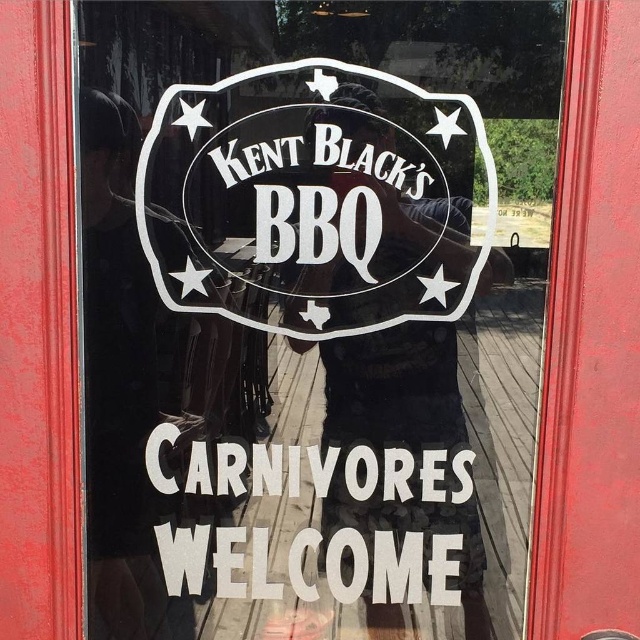
What do you see at coordinates (257, 468) in the screenshot?
I see `white matte sign at center` at bounding box center [257, 468].

Which of these two, white matte sign at center or white vinyl sign at center, stands shorter?

With less height is white matte sign at center.

Does point (458, 493) lie in front of point (262, 67)?

No.

At what (x,y) coordinates should I click in order to perform the action: click on white matte sign at center. Please return your answer as a coordinate pair (x, y). This screenshot has width=640, height=640. Looking at the image, I should click on (257, 468).